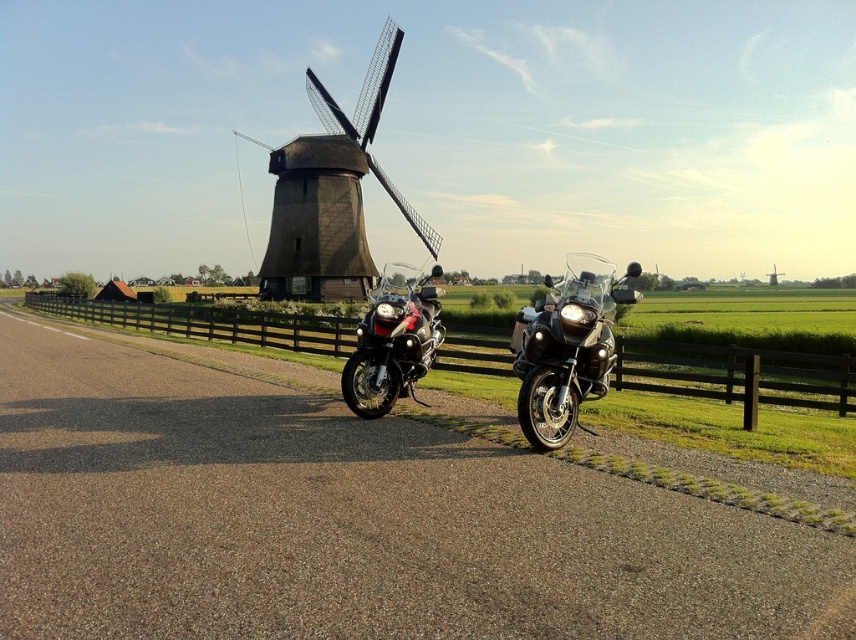
You are a tourist standing on the road and want to take a photo of both the brown wooden fence at lower center and the matte black motorcycle at center. Which object should you focus on first to ensure both are in the frame?

You should focus on the brown wooden fence at lower center first because it is closer to you than the matte black motorcycle at center, ensuring both are in the frame by adjusting the camera angle accordingly.

You are a tourist standing on the road and want to take a photo of the brown wooden fence at lower center and the glossy black motorcycle at center. Which object should you focus on first to ensure it appears larger in your photo?

A: The brown wooden fence at lower center is closer to you than the glossy black motorcycle at center, so focusing on it first will make it appear larger in the photo.